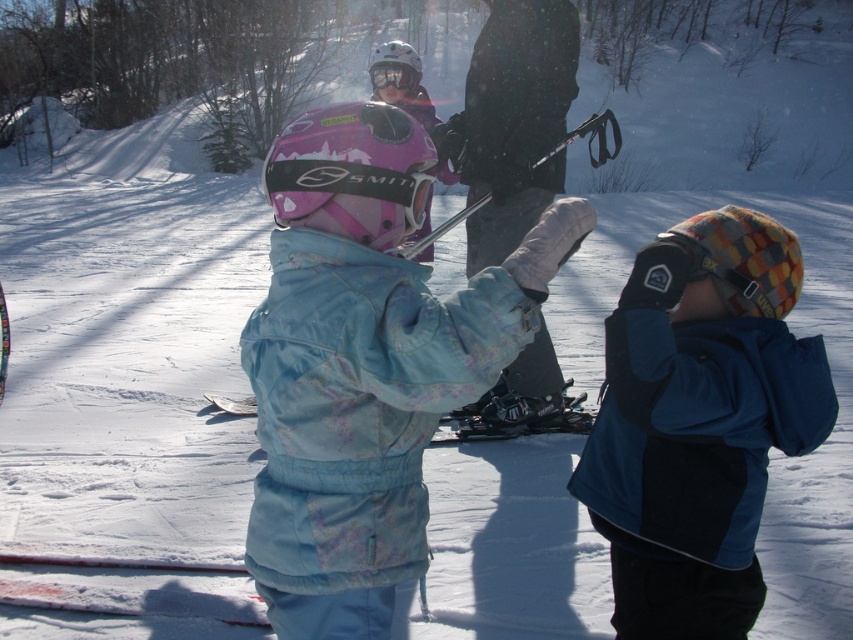
Wait, the objects are listed as two separate entries but they are the same? Let me check the input again. The user provided the objects as two entries but they are identical. Hmm, maybe a typo? The Objects are listed as matte pink helmet at center and pink matte helmet at center. The description says the first is to the left of the second. Since the objects are almost the same except for the order of

The matte pink helmet at center is to the left of the pink matte helmet at center.

Based on the photo, you are a photographer trying to capture a photo of the pink matte helmet at center and the matte blue ski at center. If you want to ensure both objects are in focus, which one should you adjust your camera focus closer to?

The pink matte helmet at center is thinner than the matte blue ski at center, so you should adjust your camera focus closer to the pink matte helmet at center to ensure both are in focus.